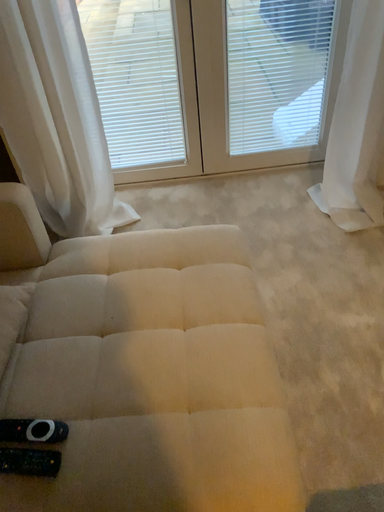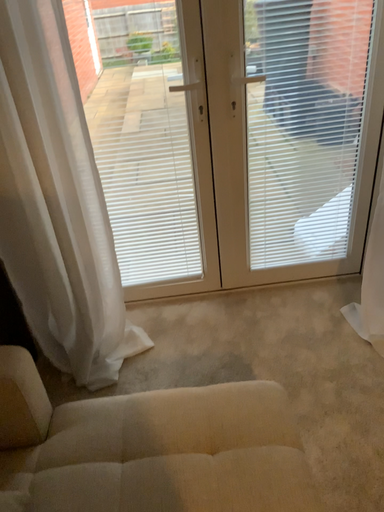
Question: How did the camera likely rotate when shooting the video?

Choices:
 (A) rotated upward
 (B) rotated downward

Answer: (A)